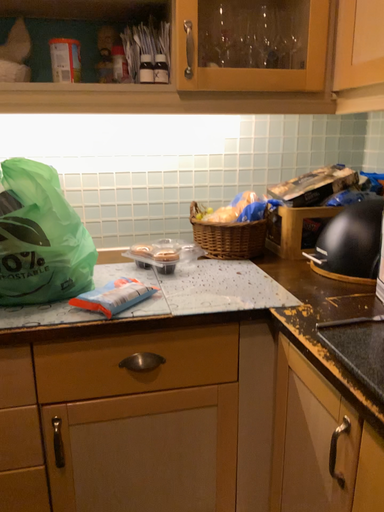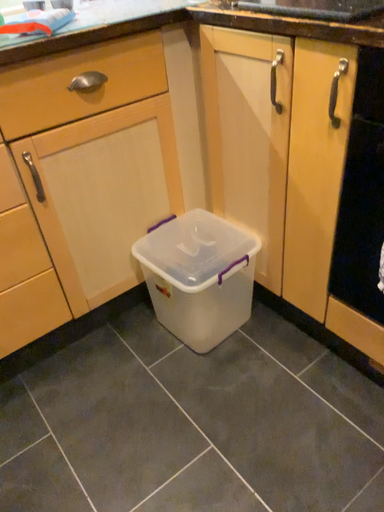
Question: How did the camera likely rotate when shooting the video?

Choices:
 (A) rotated left
 (B) rotated right

Answer: (B)